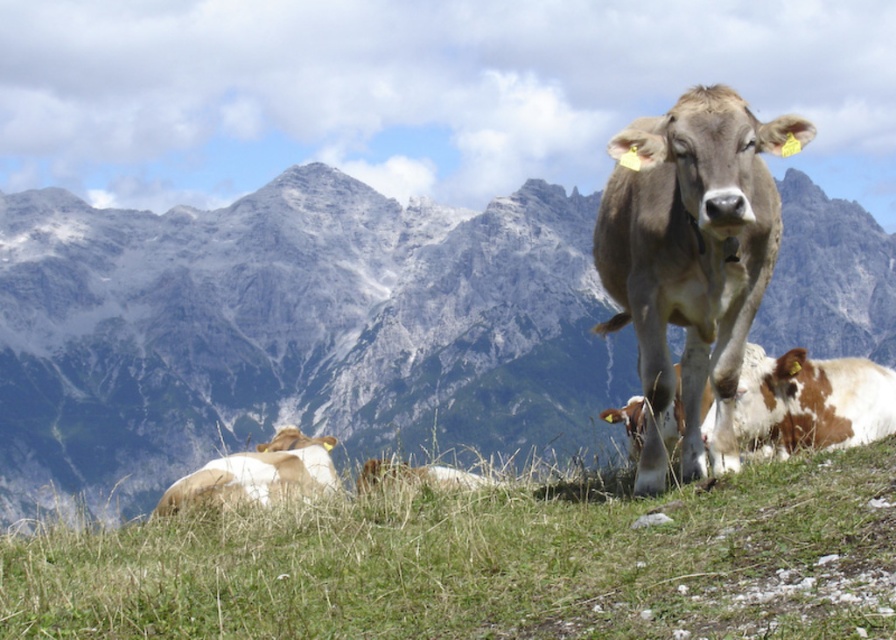
Question: Which is farther from the green grass at lower center?

Choices:
 (A) gray rocky mountain range at upper center
 (B) brown glossy cow at center

Answer: (A)

Question: Which of these objects is positioned closest to the gray rocky mountain range at upper center?

Choices:
 (A) white and brown cow at lower left
 (B) green grass at lower center
 (C) brown glossy cow at center

Answer: (A)

Question: Which point appears closest to the camera in this image?

Choices:
 (A) (797, 593)
 (B) (216, 368)
 (C) (298, 436)
 (D) (650, 472)

Answer: (A)

Question: Considering the relative positions of brown glossy cow at center and white and brown cow at lower left in the image provided, where is brown glossy cow at center located with respect to white and brown cow at lower left?

Choices:
 (A) below
 (B) above

Answer: (B)

Question: In this image, where is green grass at lower center located relative to white and brown cow at lower left?

Choices:
 (A) left
 (B) right

Answer: (B)

Question: Is brown glossy cow at center thinner than white and brown cow at lower left?

Choices:
 (A) no
 (B) yes

Answer: (B)